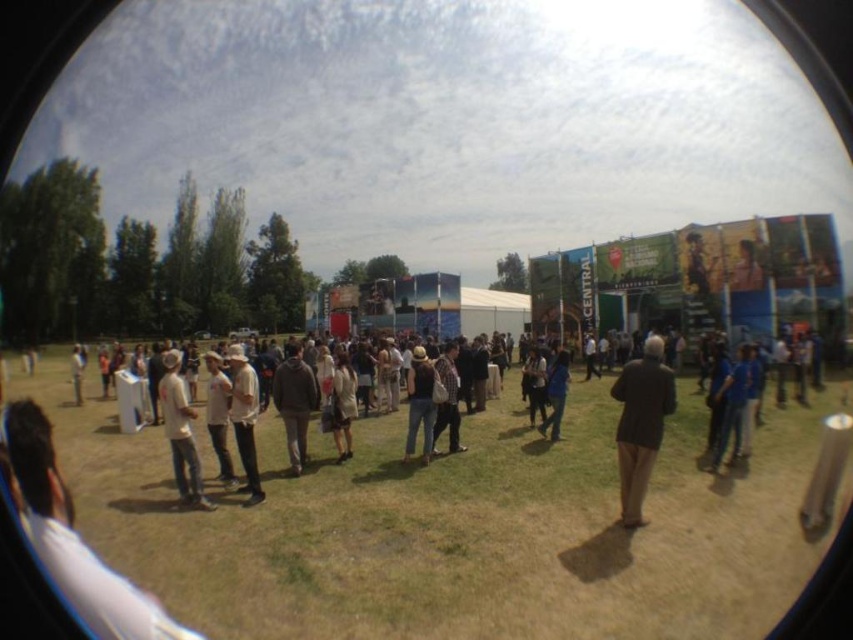
You are at an outdoor event and see two coats hanging on a rack at the center of the field. The light brown leather jacket at center and the light beige coat at center. Which one is bigger?

The light brown leather jacket at center is larger in size compared to the light beige coat at center.

You are standing at the center of the grassy field and see the point marked as point (244,419). What object is located at that point?

The point (244,419) corresponds to the light brown leather jacket at center.